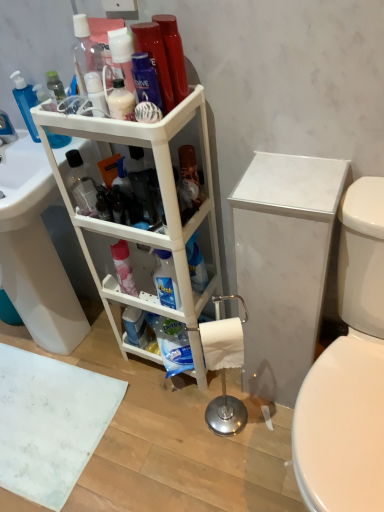
Find the location of `free space below white glossy sink at lower left (from a real-world perspective)`. free space below white glossy sink at lower left (from a real-world perspective) is located at coordinates (69, 350).